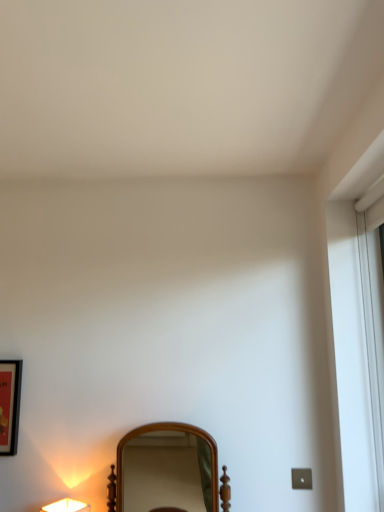
Question: In terms of width, does wooden mirror at center look wider or thinner when compared to matte white lamp at lower left?

Choices:
 (A) thin
 (B) wide

Answer: (B)

Question: Is wooden mirror at center to the left or to the right of matte white lamp at lower left in the image?

Choices:
 (A) right
 (B) left

Answer: (A)

Question: Based on their relative distances, which object is nearer to the matte white lamp at lower left?

Choices:
 (A) wooden mirror at center
 (B) matte black picture frame at left

Answer: (B)

Question: Based on their relative distances, which object is farther from the matte white lamp at lower left?

Choices:
 (A) matte black picture frame at left
 (B) wooden mirror at center

Answer: (B)